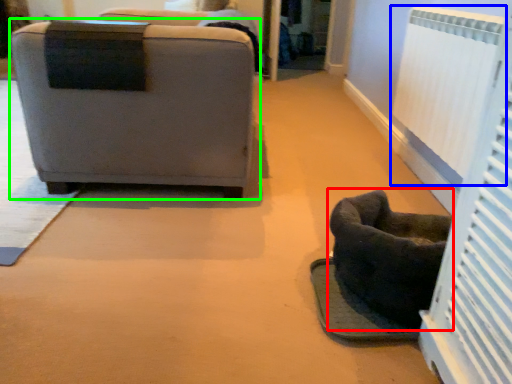
Question: Based on their relative distances, which object is nearer to furniture (highlighted by a red box)? Choose from radiator (highlighted by a blue box) and chair (highlighted by a green box).

Choices:
 (A) radiator
 (B) chair

Answer: (A)